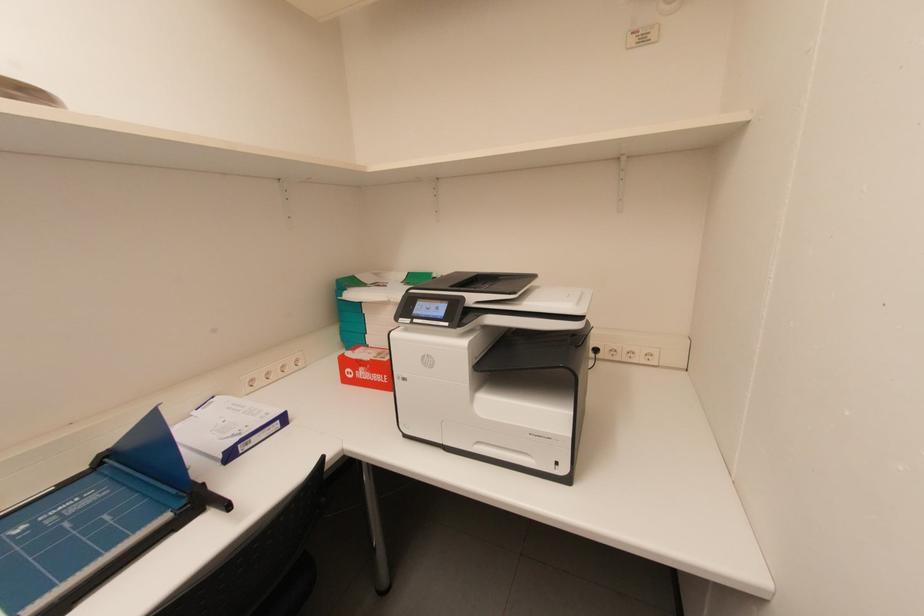
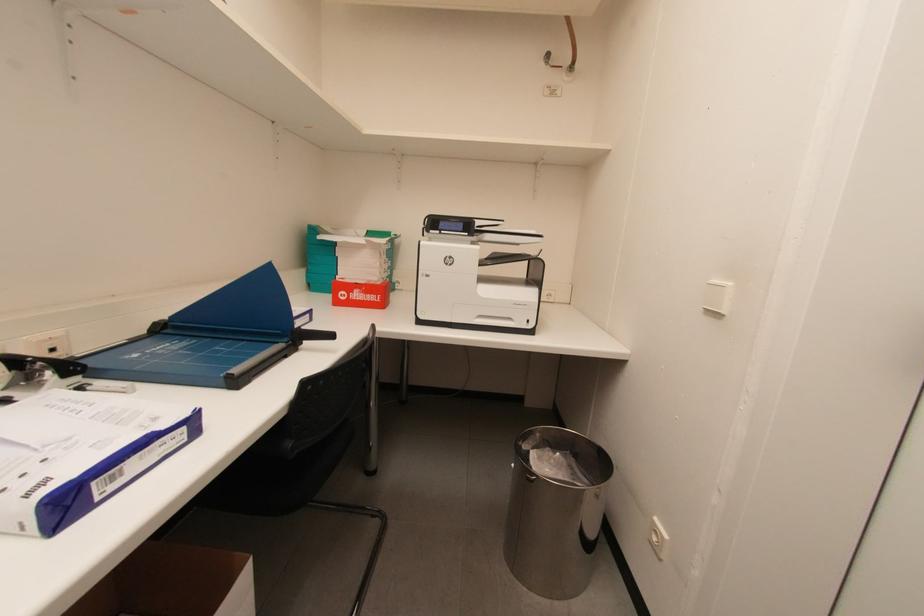
Question: The camera is either moving clockwise (left) or counter-clockwise (right) around the object. The first image is from the beginning of the video and the second image is from the end. Is the camera moving left or right when shooting the video?

Choices:
 (A) Left
 (B) Right

Answer: (A)